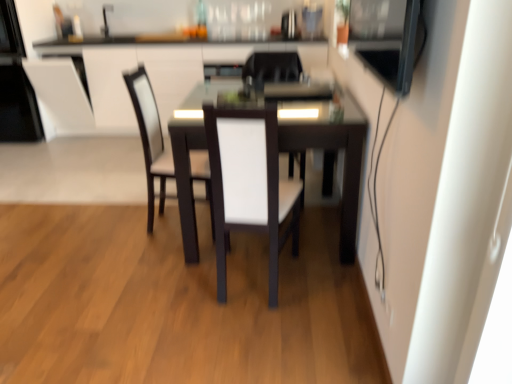
The height and width of the screenshot is (384, 512). In order to click on vacant space underneath metallic stainless steel microwave at upper right, the 1th appliance positioned from the front (from a real-world perspective) in this screenshot , I will do `click(348, 310)`.